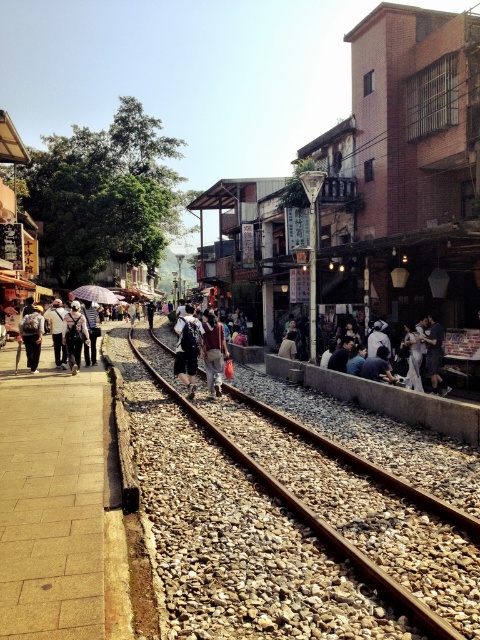
Does denim jacket at center appear over denim jacket at left?

Actually, denim jacket at center is below denim jacket at left.

Can you confirm if denim jacket at center is bigger than denim jacket at left?

Incorrect, denim jacket at center is not larger than denim jacket at left.

Which is behind, point (215, 330) or point (21, 328)?

Positioned behind is point (21, 328).

Where is `denim jacket at center`? denim jacket at center is located at coordinates (214, 353).

Measure the distance from denim jacket at left to purple matte umbrella at center.

denim jacket at left and purple matte umbrella at center are 9.69 meters apart from each other.

Is denim jacket at left taller than purple matte umbrella at center?

No.

Is point (28, 326) positioned behind point (95, 296)?

That is False.

The image size is (480, 640). In order to click on denim jacket at left in this screenshot , I will do `click(32, 336)`.

The image size is (480, 640). Identify the location of denim jacket at left. (32, 336).

Who is more distant from viewer, (31,314) or (61,348)?

The point (61,348) is more distant.

Between point (26, 348) and point (59, 324), which one is positioned in front?

Point (26, 348)

The height and width of the screenshot is (640, 480). Identify the location of denim jacket at left. (32, 336).